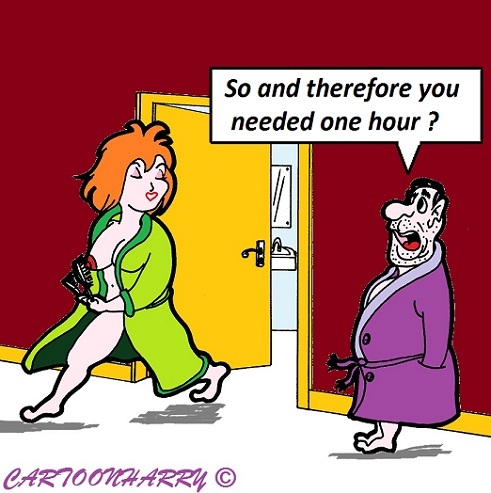
Find the location of a particular element. The image size is (491, 493). hair brushes is located at coordinates (84, 275).